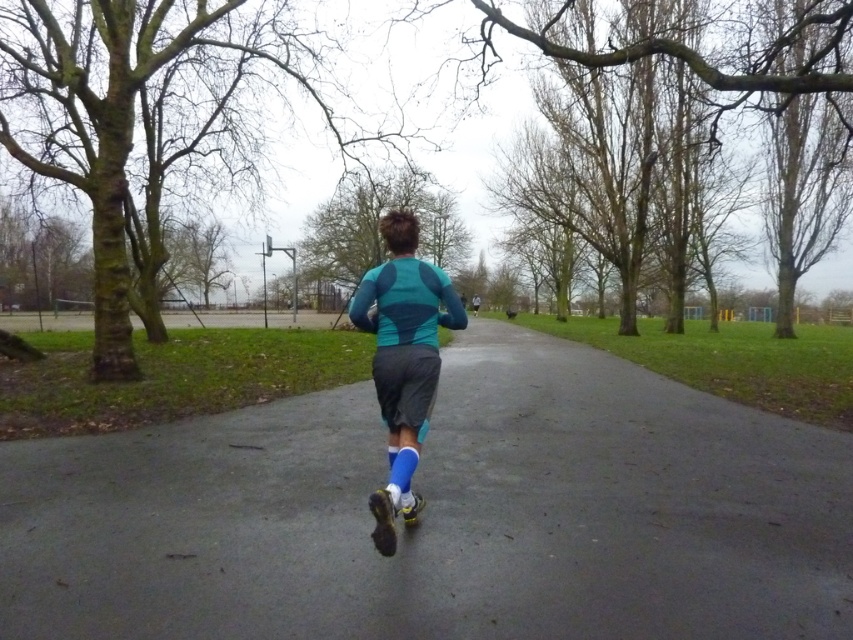
Question: Is smooth asphalt path at center to the right of teal matte athletic top at center from the viewer's perspective?

Choices:
 (A) yes
 (B) no

Answer: (A)

Question: Does smooth asphalt path at center have a greater width compared to teal matte athletic top at center?

Choices:
 (A) yes
 (B) no

Answer: (A)

Question: Can you confirm if smooth asphalt path at center is bigger than teal matte athletic top at center?

Choices:
 (A) no
 (B) yes

Answer: (B)

Question: Which point is closer to the camera taking this photo?

Choices:
 (A) (457, 328)
 (B) (25, 506)

Answer: (A)

Question: Which point is farther to the camera?

Choices:
 (A) smooth asphalt path at center
 (B) teal matte athletic top at center

Answer: (B)

Question: Among these objects, which one is nearest to the camera?

Choices:
 (A) smooth asphalt path at center
 (B) teal matte athletic top at center

Answer: (A)